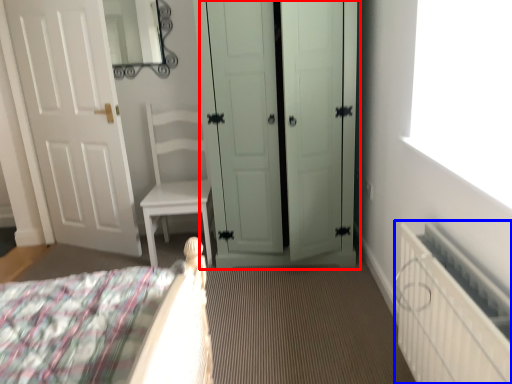
Question: Which of the following is the closest to the observer, door (highlighted by a red box) or radiator (highlighted by a blue box)?

Choices:
 (A) door
 (B) radiator

Answer: (B)